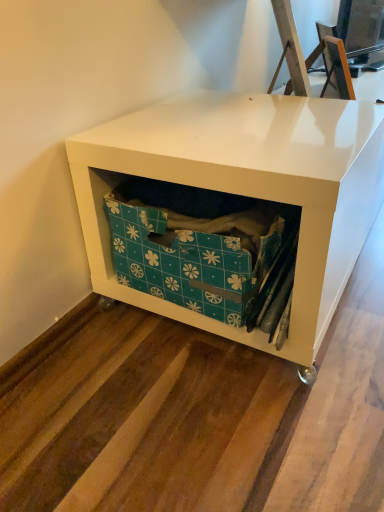
What do you see at coordinates (248, 188) in the screenshot?
I see `white glossy storage unit at center` at bounding box center [248, 188].

The height and width of the screenshot is (512, 384). I want to click on white glossy storage unit at center, so pos(248,188).

The height and width of the screenshot is (512, 384). What do you see at coordinates (192, 250) in the screenshot?
I see `teal floral-patterned box at center` at bounding box center [192, 250].

In order to click on teal floral-patterned box at center in this screenshot , I will do `click(192, 250)`.

Locate an element on the screen. The width and height of the screenshot is (384, 512). white glossy storage unit at center is located at coordinates (248, 188).

Is teal floral-patterned box at center to the left of white glossy storage unit at center from the viewer's perspective?

Indeed, teal floral-patterned box at center is positioned on the left side of white glossy storage unit at center.

Does teal floral-patterned box at center come in front of white glossy storage unit at center?

No, teal floral-patterned box at center is further to the viewer.

Which is farther, (112,214) or (180,179)?

Point (112,214)

From the image's perspective, is teal floral-patterned box at center located above or below white glossy storage unit at center?

Based on their image positions, teal floral-patterned box at center is located beneath white glossy storage unit at center.

From a real-world perspective, who is located higher, teal floral-patterned box at center or white glossy storage unit at center?

teal floral-patterned box at center.

Can you confirm if teal floral-patterned box at center is wider than white glossy storage unit at center?

No, teal floral-patterned box at center is not wider than white glossy storage unit at center.

Considering the relative sizes of teal floral-patterned box at center and white glossy storage unit at center in the image provided, is teal floral-patterned box at center shorter than white glossy storage unit at center?

Yes, teal floral-patterned box at center is shorter than white glossy storage unit at center.

Is teal floral-patterned box at center bigger than white glossy storage unit at center?

Incorrect, teal floral-patterned box at center is not larger than white glossy storage unit at center.

Choose the correct answer: Is teal floral-patterned box at center inside white glossy storage unit at center or outside it?

teal floral-patterned box at center lies within the bounds of white glossy storage unit at center.

Is teal floral-patterned box at center next to white glossy storage unit at center?

No, teal floral-patterned box at center is not in contact with white glossy storage unit at center.

Is teal floral-patterned box at center oriented towards white glossy storage unit at center?

Yes, teal floral-patterned box at center is aimed at white glossy storage unit at center.

Find the location of `furniture beneath the teal floral-patterned box at center (from a real-world perspective)`. furniture beneath the teal floral-patterned box at center (from a real-world perspective) is located at coordinates (248, 188).

Considering the relative positions of white glossy storage unit at center and teal floral-patterned box at center in the image provided, is white glossy storage unit at center to the right of teal floral-patterned box at center from the viewer's perspective?

Indeed, white glossy storage unit at center is positioned on the right side of teal floral-patterned box at center.

Which object is further away from the camera taking this photo, white glossy storage unit at center or teal floral-patterned box at center?

Positioned behind is teal floral-patterned box at center.

Between point (324, 294) and point (264, 238), which one is positioned behind?

The point (324, 294) is behind.

From the image's perspective, is white glossy storage unit at center above or below teal floral-patterned box at center?

Based on their image positions, white glossy storage unit at center is located above teal floral-patterned box at center.

From a real-world perspective, who is located higher, white glossy storage unit at center or teal floral-patterned box at center?

teal floral-patterned box at center.

Does white glossy storage unit at center have a lesser width compared to teal floral-patterned box at center?

Incorrect, the width of white glossy storage unit at center is not less than that of teal floral-patterned box at center.

In terms of height, does white glossy storage unit at center look taller or shorter compared to teal floral-patterned box at center?

Clearly, white glossy storage unit at center is taller compared to teal floral-patterned box at center.

Looking at this image, can you confirm if white glossy storage unit at center is bigger than teal floral-patterned box at center?

Yes, white glossy storage unit at center is bigger than teal floral-patterned box at center.

Which is correct: white glossy storage unit at center is inside teal floral-patterned box at center, or outside of it?

white glossy storage unit at center is not inside teal floral-patterned box at center, it's outside.

Can you see white glossy storage unit at center touching teal floral-patterned box at center?

No, white glossy storage unit at center is not making contact with teal floral-patterned box at center.

Is white glossy storage unit at center facing away from teal floral-patterned box at center?

That's right, white glossy storage unit at center is facing away from teal floral-patterned box at center.

How different are the orientations of white glossy storage unit at center and teal floral-patterned box at center in degrees?

white glossy storage unit at center and teal floral-patterned box at center are facing 95 degrees away from each other.

Image resolution: width=384 pixels, height=512 pixels. In order to click on furniture that is above the teal floral-patterned box at center (from the image's perspective) in this screenshot , I will do `click(248, 188)`.

In the image, there is a teal floral-patterned box at center. Identify the location of furniture above it (from the image's perspective). (248, 188).

This screenshot has height=512, width=384. In order to click on furniture on the right side of teal floral-patterned box at center in this screenshot , I will do `click(248, 188)`.